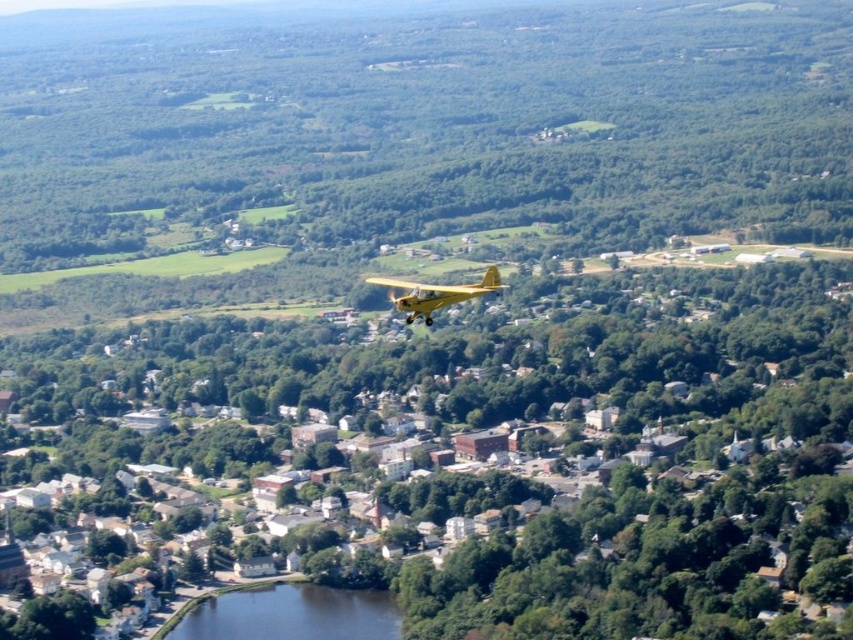
Can you confirm if dark blue water at lower center is taller than yellow matte airplane at center?

Yes, dark blue water at lower center is taller than yellow matte airplane at center.

Does point (352, 605) lie behind point (410, 317)?

Yes, point (352, 605) is farther from viewer.

Is point (254, 618) positioned after point (381, 282)?

That is True.

Find the location of a particular element. The height and width of the screenshot is (640, 853). dark blue water at lower center is located at coordinates point(292,614).